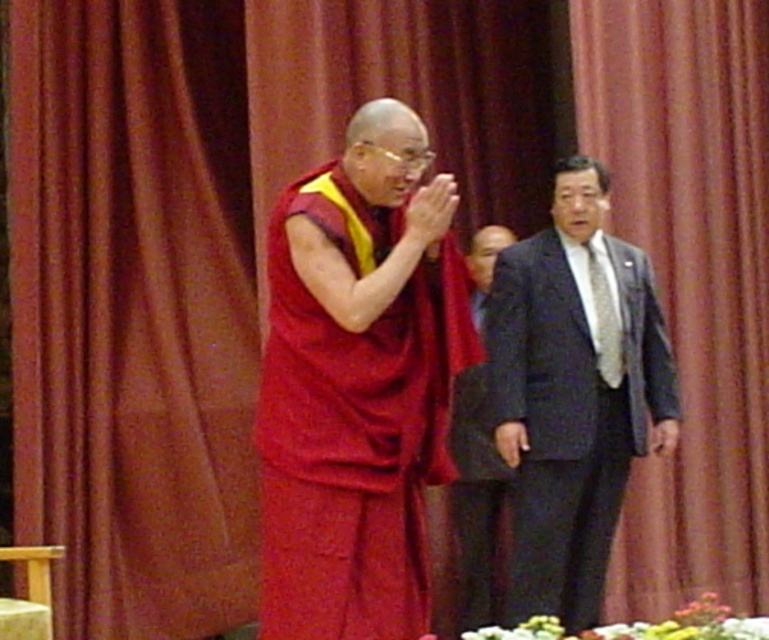
Question: In this image, where is matte red robe at center located relative to dark gray suit at right?

Choices:
 (A) above
 (B) below

Answer: (A)

Question: Which point is closer to the camera taking this photo?

Choices:
 (A) (541, 390)
 (B) (435, 230)
 (C) (485, 512)

Answer: (B)

Question: Does matte red robe at center appear under dark gray suit at center?

Choices:
 (A) no
 (B) yes

Answer: (A)

Question: Is dark gray suit at right thinner than dark gray suit at center?

Choices:
 (A) no
 (B) yes

Answer: (A)

Question: Which object is farther from the camera taking this photo?

Choices:
 (A) dark gray suit at center
 (B) matte red robe at center

Answer: (A)

Question: Estimate the real-world distances between objects in this image. Which object is farther from the dark gray suit at center?

Choices:
 (A) matte red robe at center
 (B) dark gray suit at right

Answer: (A)